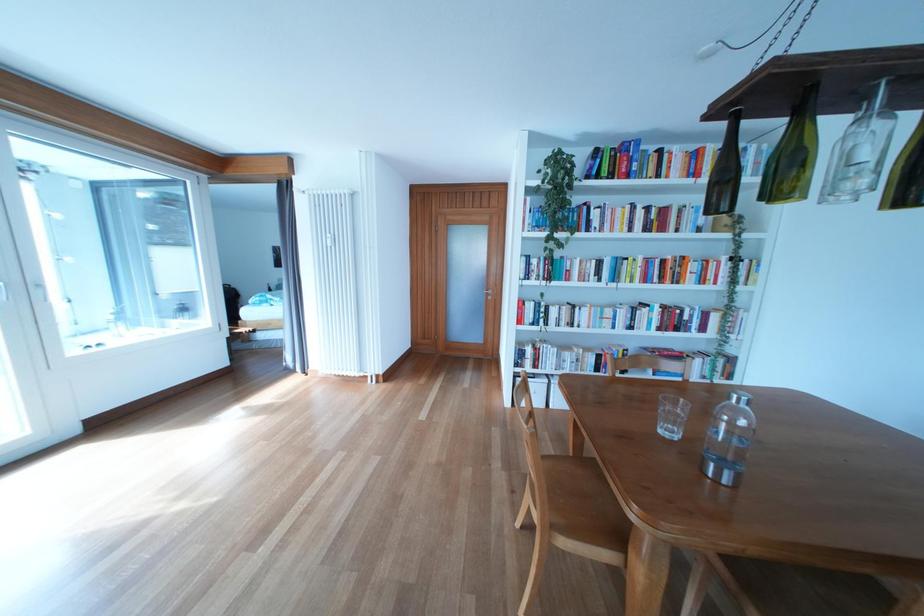
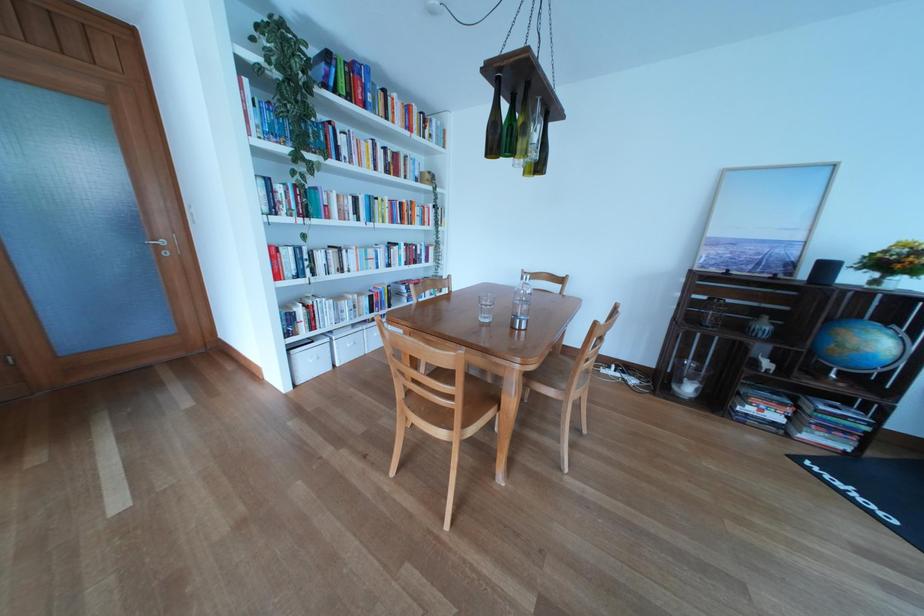
The point at (652, 219) is marked in the first image. Where is the corresponding point in the second image?

(394, 159)